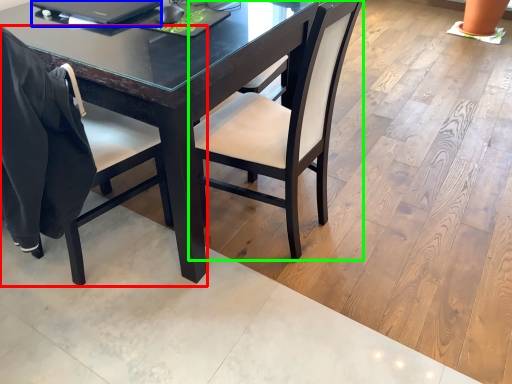
Question: Which object is the farthest from chair (highlighted by a red box)? Choose among these: laptop (highlighted by a blue box) or chair (highlighted by a green box).

Choices:
 (A) laptop
 (B) chair

Answer: (A)